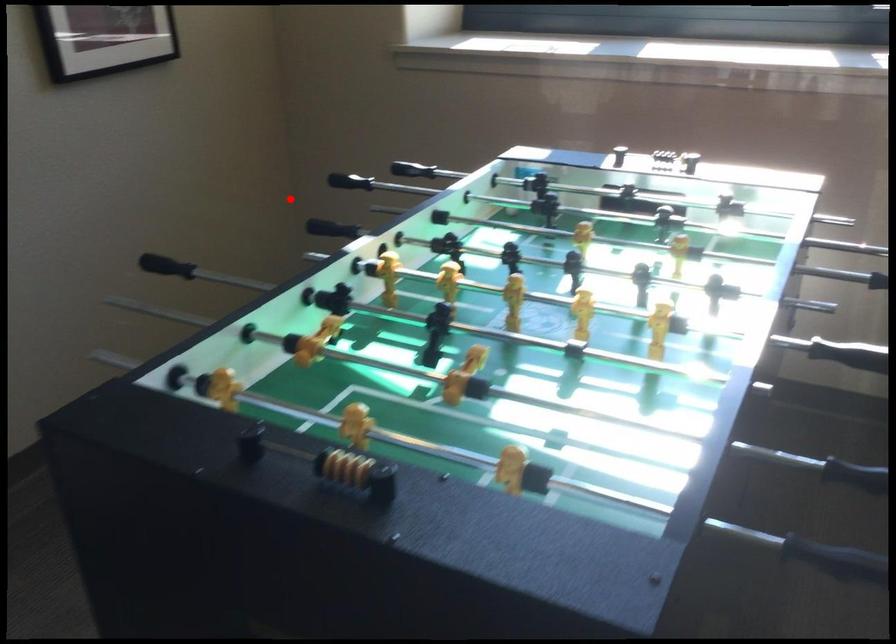
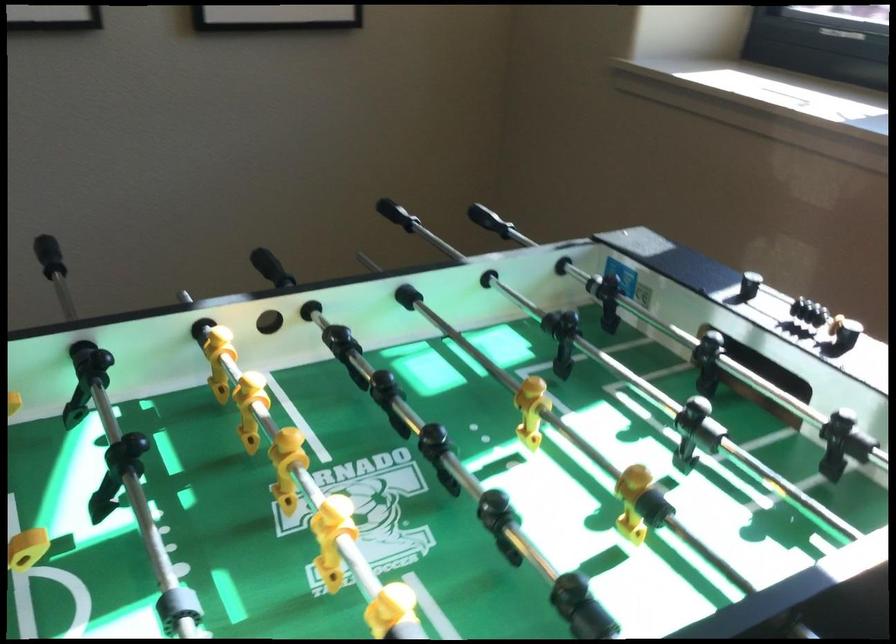
Question: A red point is marked in image1. In image2, is the corresponding 3D point closer to the camera or farther? Reply with the corresponding letter.

Choices:
 (A) The corresponding 3D point is closer.
 (B) The corresponding 3D point is farther.

Answer: (A)